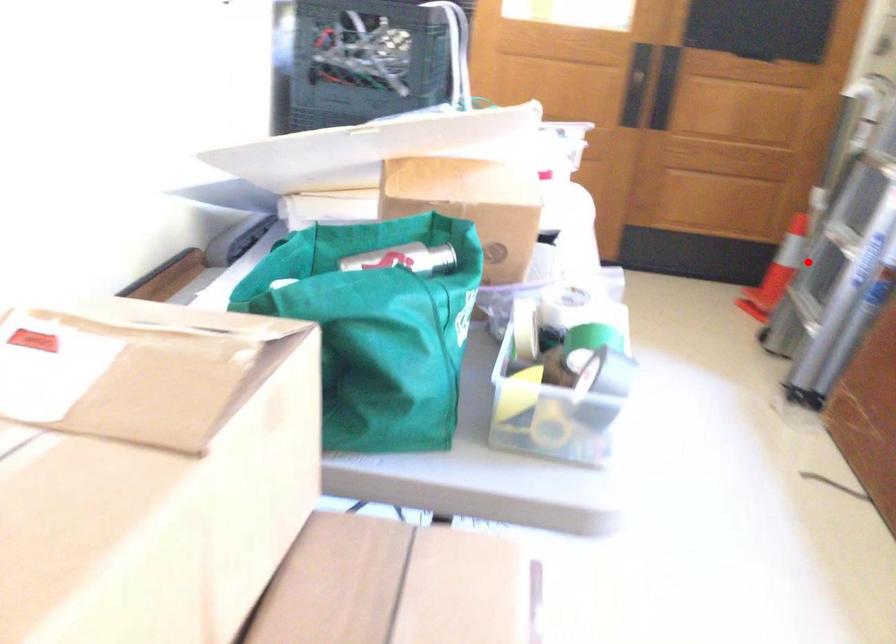
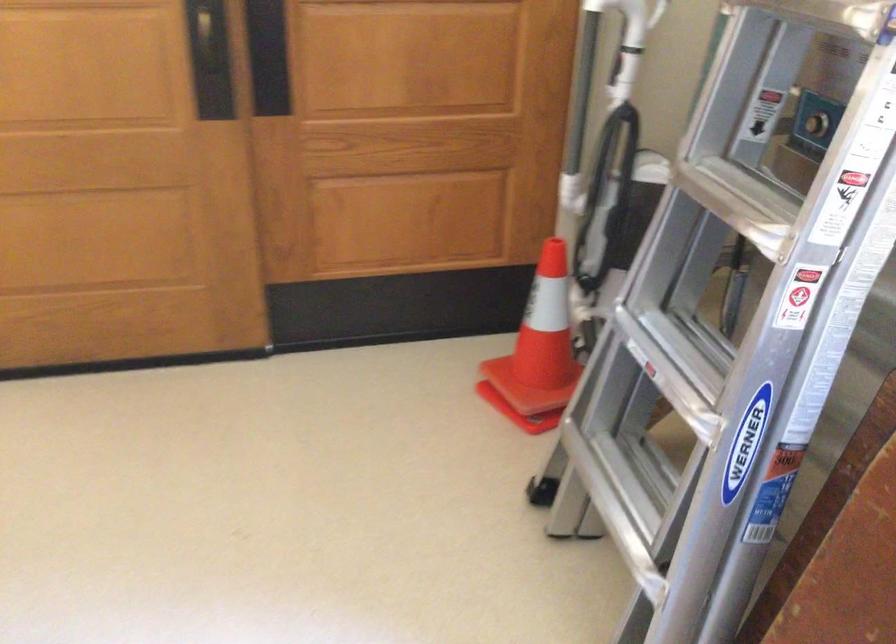
Find the pixel in the second image that matches the highlighted location in the first image.

(539, 343)